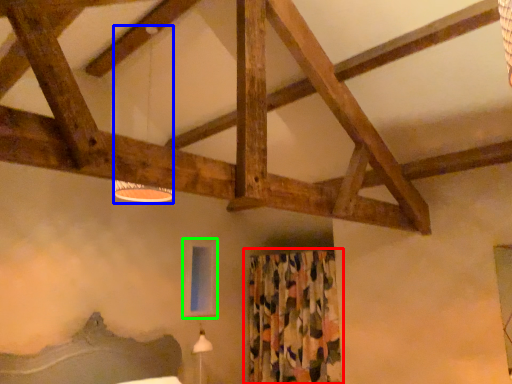
Question: Estimate the real-world distances between objects in this image. Which object is closer to curtain (highlighted by a red box), lamp (highlighted by a blue box) or window screen (highlighted by a green box)?

Choices:
 (A) lamp
 (B) window screen

Answer: (B)